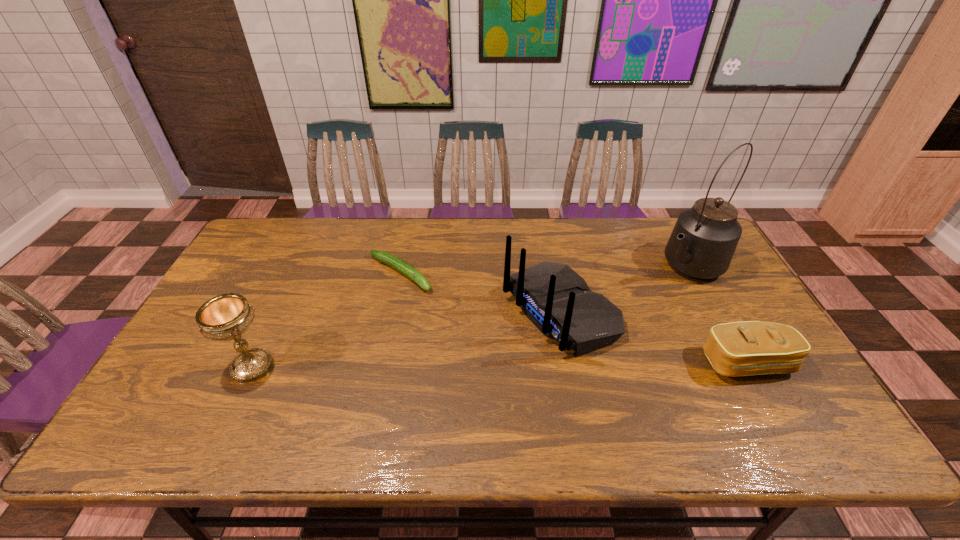
Image resolution: width=960 pixels, height=540 pixels. I want to click on chalice, so 226,317.

Image resolution: width=960 pixels, height=540 pixels. Identify the location of clutch bag. (746, 348).

Image resolution: width=960 pixels, height=540 pixels. I want to click on the third object from right to left, so click(558, 301).

Locate an element on the screen. the tallest object is located at coordinates (704, 239).

Where is `zucchini`? Image resolution: width=960 pixels, height=540 pixels. zucchini is located at coordinates (387, 258).

The height and width of the screenshot is (540, 960). I want to click on the shortest object, so click(387, 258).

Find the location of a particular element. The width and height of the screenshot is (960, 540). vacant space located on the back of the leftmost object is located at coordinates (303, 255).

The width and height of the screenshot is (960, 540). Identify the location of vacant space located 0.060m on the zipper side of the clutch bag. (771, 406).

Locate an element on the screen. vacant area located 0.270m on the back of the third object from right to left is located at coordinates (424, 380).

Locate an element on the screen. blank space located 0.220m on the back of the third object from right to left is located at coordinates (x=442, y=371).